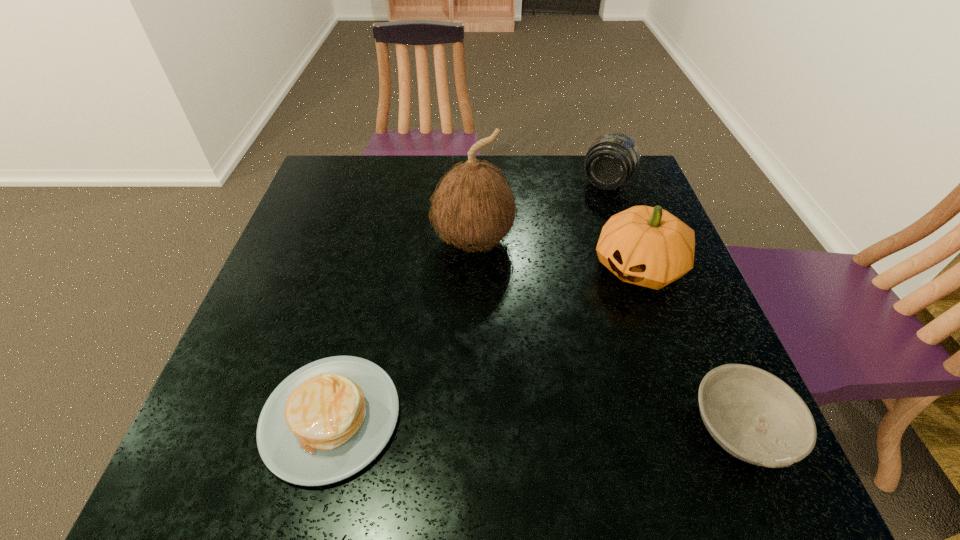
At what (x,y) coordinates should I click in order to perform the action: click on the leftmost object. Please return your answer as a coordinate pair (x, y). Looking at the image, I should click on (328, 420).

Locate an element on the screen. bowl is located at coordinates (756, 417).

Identify the location of the second object from left to right. This screenshot has height=540, width=960. (473, 207).

This screenshot has height=540, width=960. I want to click on the tallest object, so click(x=473, y=207).

Locate an element on the screen. telephoto lens is located at coordinates (612, 159).

You are a GUI agent. You are given a task and a screenshot of the screen. Output one action in this format:
    pyautogui.click(x=<x>, y=<y>)
    Task: Click on the farthest object
    The height and width of the screenshot is (540, 960).
    Given the screenshot: What is the action you would take?
    [612, 159]

In order to click on the second tallest object in this screenshot , I will do `click(648, 246)`.

Find the location of a particular element. The width and height of the screenshot is (960, 540). blank space located on the back of the leftmost object is located at coordinates (375, 238).

Find the location of a particular element. The width and height of the screenshot is (960, 540). free space located on the back of the bowl is located at coordinates (691, 307).

Image resolution: width=960 pixels, height=540 pixels. I want to click on blank space located 0.200m on the surface of the tallest object, so click(476, 340).